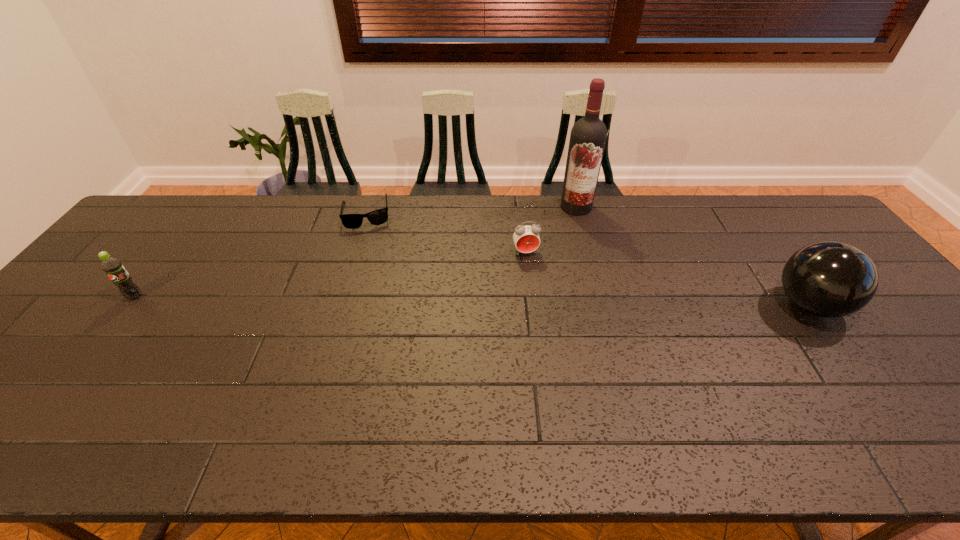
You are a GUI agent. You are given a task and a screenshot of the screen. Output one action in this format:
    pyautogui.click(x=<x>, y=<y>)
    Task: Click on the free region located 0.130m on the face of the third object from right to left
    The image size is (960, 540).
    Given the screenshot: What is the action you would take?
    pyautogui.click(x=536, y=289)

Image resolution: width=960 pixels, height=540 pixels. I want to click on wine bottle located in the far edge section of the desktop, so click(x=588, y=136).

Where is `sunglasses located at the far edge`? Image resolution: width=960 pixels, height=540 pixels. sunglasses located at the far edge is located at coordinates (351, 221).

The image size is (960, 540). I want to click on object situated at the left edge, so click(x=114, y=269).

Find the location of a particular element. object present at the right edge is located at coordinates pos(830,279).

Identify the location of vacant space at the far edge of the desktop. Image resolution: width=960 pixels, height=540 pixels. (700, 228).

Where is `vacant space at the near edge of the desktop`? Image resolution: width=960 pixels, height=540 pixels. vacant space at the near edge of the desktop is located at coordinates (800, 405).

In the image, there is a desktop. In order to click on vacant space at the left edge in this screenshot , I will do click(x=25, y=362).

Where is `free spot at the far left corner of the desktop`? free spot at the far left corner of the desktop is located at coordinates (180, 202).

Locate an element on the screen. empty space between the rightmost object and the fourth tallest object is located at coordinates (667, 279).